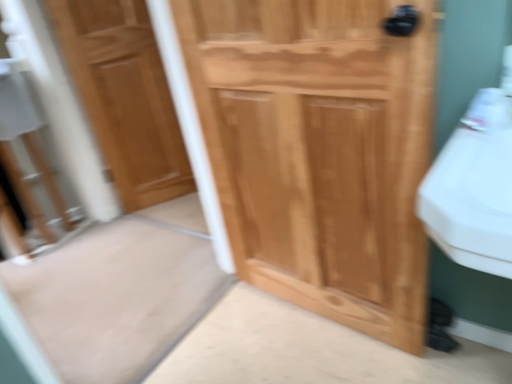
Question: From a real-world perspective, is light brown wood door at left, acting as the 1th door starting from the left, positioned above or below natural wood cabinet at center, which is the first door in right-to-left order?

Choices:
 (A) above
 (B) below

Answer: (A)

Question: Would you say light brown wood door at left, acting as the 1th door starting from the left, is inside or outside natural wood cabinet at center, which ranks as the 2th door in back-to-front order?

Choices:
 (A) outside
 (B) inside

Answer: (A)

Question: Is light brown wood door at left, the first door in the back-to-front sequence, wider or thinner than natural wood cabinet at center, which ranks as the 2th door in back-to-front order?

Choices:
 (A) wide
 (B) thin

Answer: (B)

Question: Considering the positions of natural wood cabinet at center, which is the first door in right-to-left order, and light brown wood door at left, acting as the 1th door starting from the left, in the image, is natural wood cabinet at center, which is the first door in right-to-left order, wider or thinner than light brown wood door at left, acting as the 1th door starting from the left,?

Choices:
 (A) thin
 (B) wide

Answer: (B)

Question: In terms of size, does natural wood cabinet at center, arranged as the 1th door when viewed from the front, appear bigger or smaller than light brown wood door at left, the first door in the back-to-front sequence?

Choices:
 (A) small
 (B) big

Answer: (B)

Question: Considering the positions of natural wood cabinet at center, arranged as the 1th door when viewed from the front, and light brown wood door at left, acting as the 1th door starting from the left, in the image, is natural wood cabinet at center, arranged as the 1th door when viewed from the front, taller or shorter than light brown wood door at left, acting as the 1th door starting from the left,?

Choices:
 (A) short
 (B) tall

Answer: (A)

Question: From a real-world perspective, is natural wood cabinet at center, which ranks as the 2th door in back-to-front order, physically located above or below light brown wood door at left, the 2th door when ordered from front to back?

Choices:
 (A) above
 (B) below

Answer: (B)